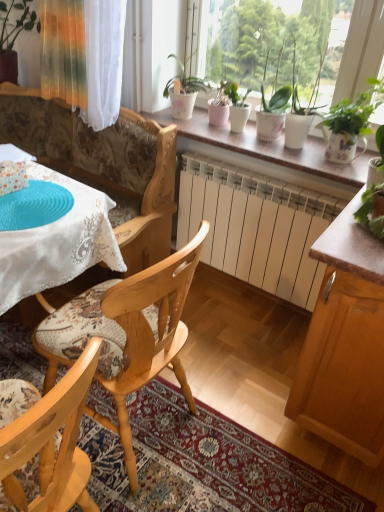
Identify the location of vacant space to the right of light wood chair at center, the first chair in the back-to-front sequence. This screenshot has height=512, width=384. (235, 379).